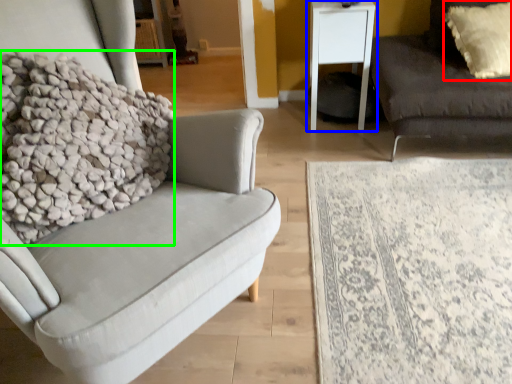
Question: Considering the real-world distances, which object is closest to pillow (highlighted by a red box)? table (highlighted by a blue box) or blanket (highlighted by a green box).

Choices:
 (A) table
 (B) blanket

Answer: (A)